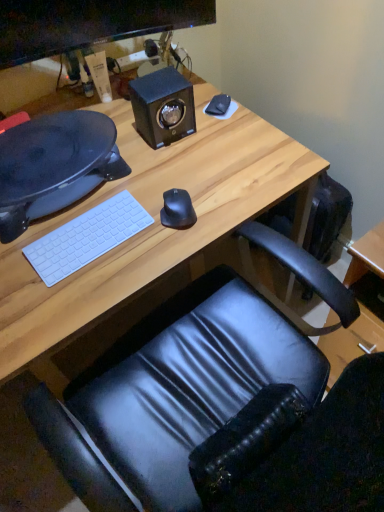
Find the location of a particular element. This screenshot has height=512, width=384. free space to the right of black matte mouse at center is located at coordinates (231, 199).